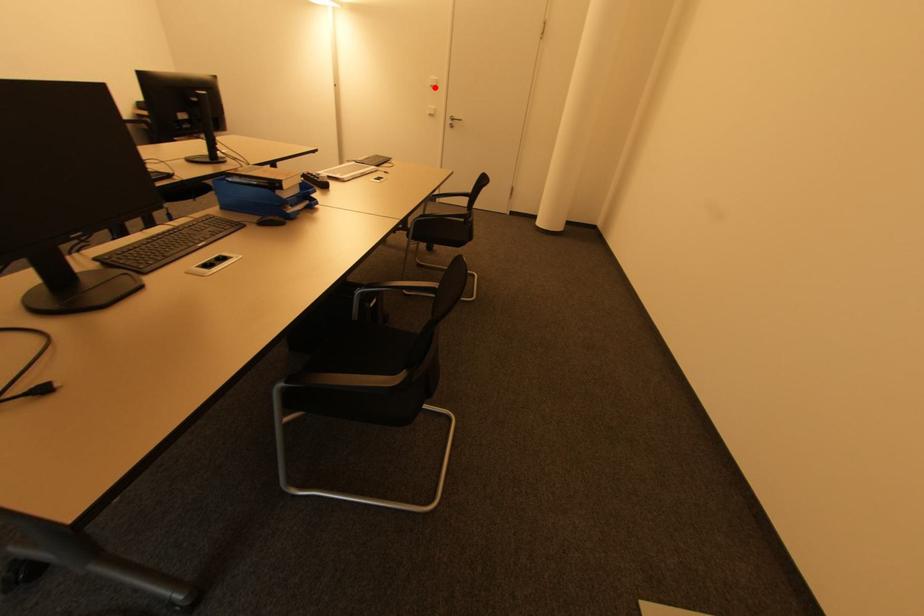
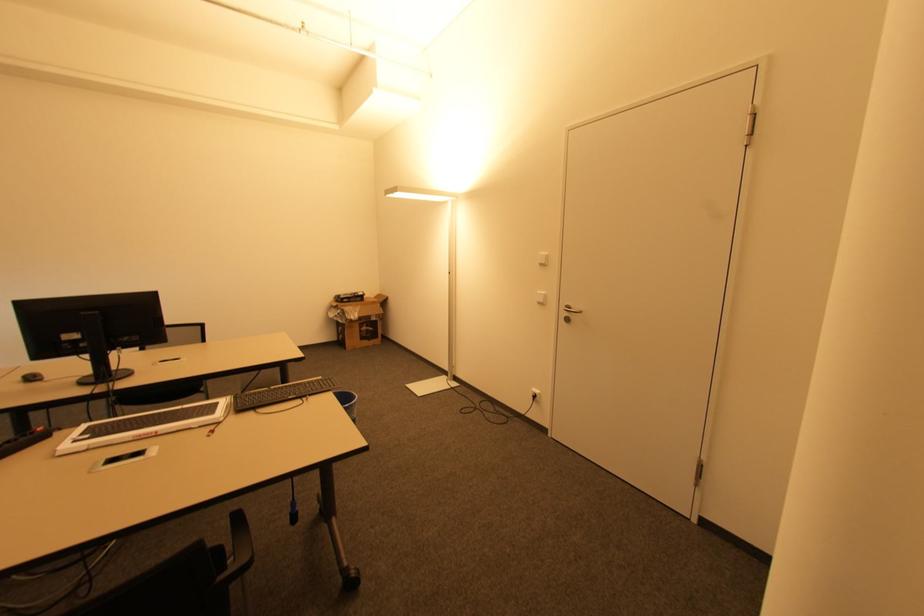
Where in the second image is the point corresponding to the highlighted location from the first image?

(542, 265)